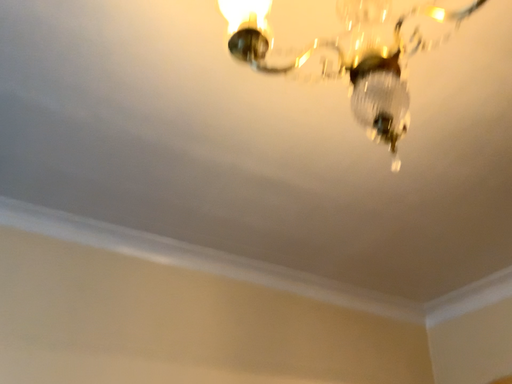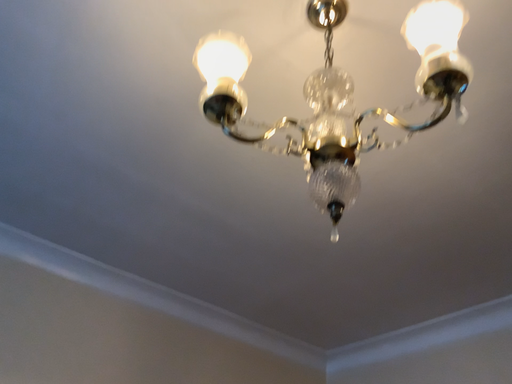
Question: Which way did the camera rotate in the video?

Choices:
 (A) rotated right
 (B) rotated left

Answer: (A)